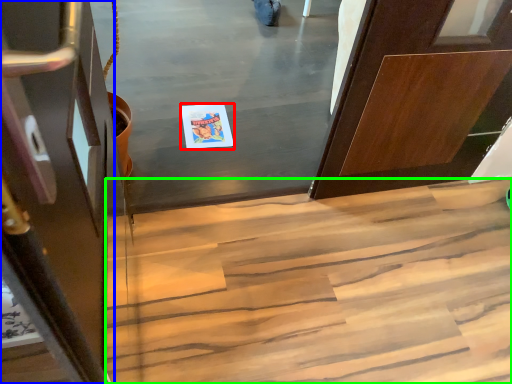
Question: Estimate the real-world distances between objects in this image. Which object is closer to postcard (highlighted by a red box), door (highlighted by a blue box) or stairs (highlighted by a green box)?

Choices:
 (A) door
 (B) stairs

Answer: (B)